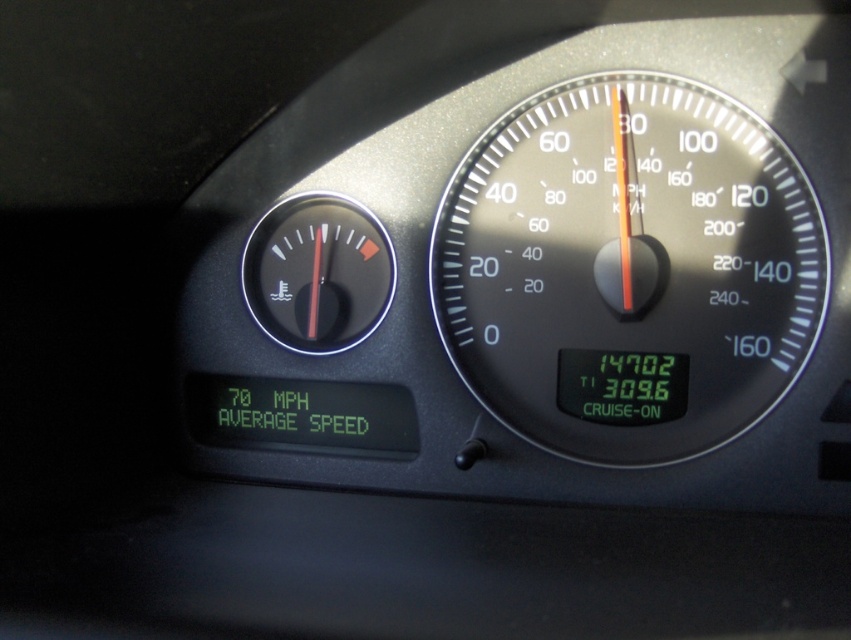
Question: Which object is closer to the camera taking this photo?

Choices:
 (A) black plastic speedometer at center
 (B) black plastic gauge at center

Answer: (A)

Question: Is the position of black plastic speedometer at center less distant than that of black plastic gauge at center?

Choices:
 (A) no
 (B) yes

Answer: (B)

Question: Which point is closer to the camera taking this photo?

Choices:
 (A) (790, 305)
 (B) (286, 337)

Answer: (A)

Question: Is black plastic speedometer at center thinner than black plastic gauge at center?

Choices:
 (A) yes
 (B) no

Answer: (B)

Question: Can you confirm if black plastic speedometer at center is smaller than black plastic gauge at center?

Choices:
 (A) yes
 (B) no

Answer: (B)